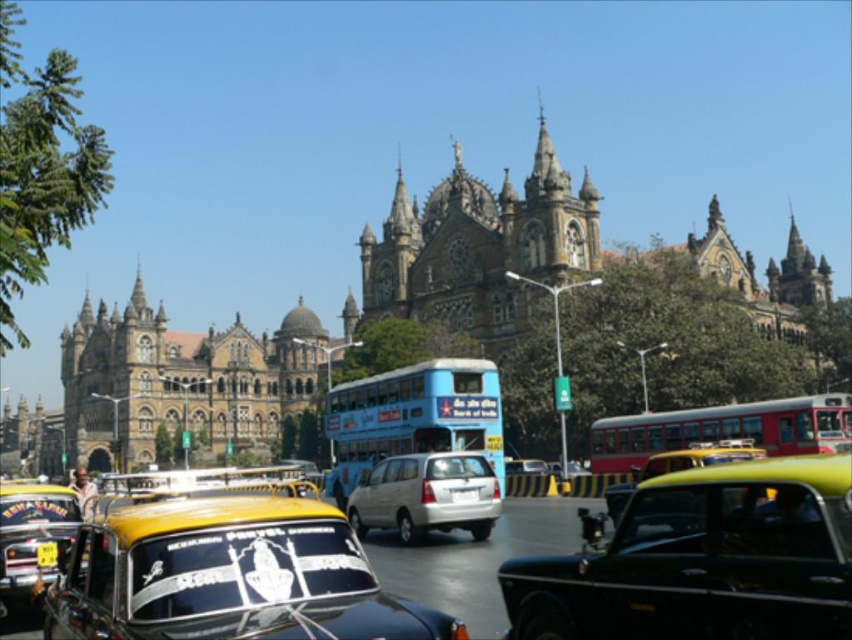
Who is more forward, (649, 483) or (462, 381)?

Point (649, 483) is in front.

Is black glossy taxi at center thinner than blue painted metal decker bus at center?

Yes, black glossy taxi at center is thinner than blue painted metal decker bus at center.

Does point (755, 579) lie behind point (355, 426)?

No.

What are the coordinates of `black glossy taxi at center` in the screenshot? It's located at (703, 561).

Between red matte bus at center and white plastic license plate at center, which one has less height?

With less height is white plastic license plate at center.

Is red matte bus at center closer to camera compared to white plastic license plate at center?

No, it is behind white plastic license plate at center.

This screenshot has height=640, width=852. What are the coordinates of `red matte bus at center` in the screenshot? It's located at point(724,429).

In order to click on yellow matte taxi cab at center in this screenshot , I will do `click(228, 577)`.

Is yellow matte taxi cab at center above white plastic license plate at center?

Incorrect, yellow matte taxi cab at center is not positioned above white plastic license plate at center.

Image resolution: width=852 pixels, height=640 pixels. What do you see at coordinates (228, 577) in the screenshot?
I see `yellow matte taxi cab at center` at bounding box center [228, 577].

I want to click on yellow matte taxi cab at center, so [x=228, y=577].